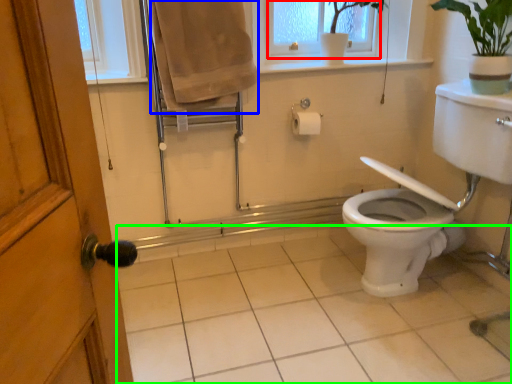
Question: Considering the real-world distances, which object is farthest from window frame (highlighted by a red box)? bath towel (highlighted by a blue box) or plain (highlighted by a green box)?

Choices:
 (A) bath towel
 (B) plain

Answer: (B)